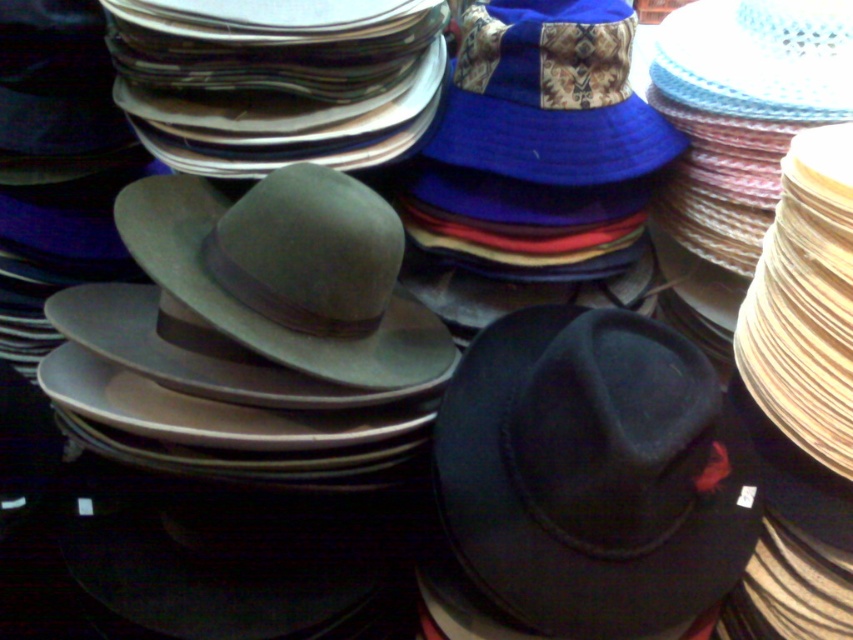
Can you confirm if black felt cowboy hat at center is positioned above blue fabric cowboy hat at upper center?

No, black felt cowboy hat at center is not above blue fabric cowboy hat at upper center.

Measure the distance between point (572,600) and camera.

Point (572,600) is 34.44 inches from camera.

Between point (492, 364) and point (576, 145), which one is positioned in front?

Positioned in front is point (492, 364).

Find the location of a particular element. Image resolution: width=853 pixels, height=640 pixels. black felt cowboy hat at center is located at coordinates (593, 474).

Does matte green felt fedora at center appear on the right side of blue fabric cowboy hat at upper center?

No, matte green felt fedora at center is not to the right of blue fabric cowboy hat at upper center.

Where is `matte green felt fedora at center`? matte green felt fedora at center is located at coordinates (289, 273).

I want to click on matte green felt fedora at center, so (289, 273).

Is black felt cowboy hat at center positioned behind matte green felt fedora at center?

No, it is not.

Consider the image. Who is positioned more to the left, black felt cowboy hat at center or matte green felt fedora at center?

From the viewer's perspective, matte green felt fedora at center appears more on the left side.

The height and width of the screenshot is (640, 853). I want to click on black felt cowboy hat at center, so click(593, 474).

This screenshot has height=640, width=853. In order to click on black felt cowboy hat at center in this screenshot , I will do `click(593, 474)`.